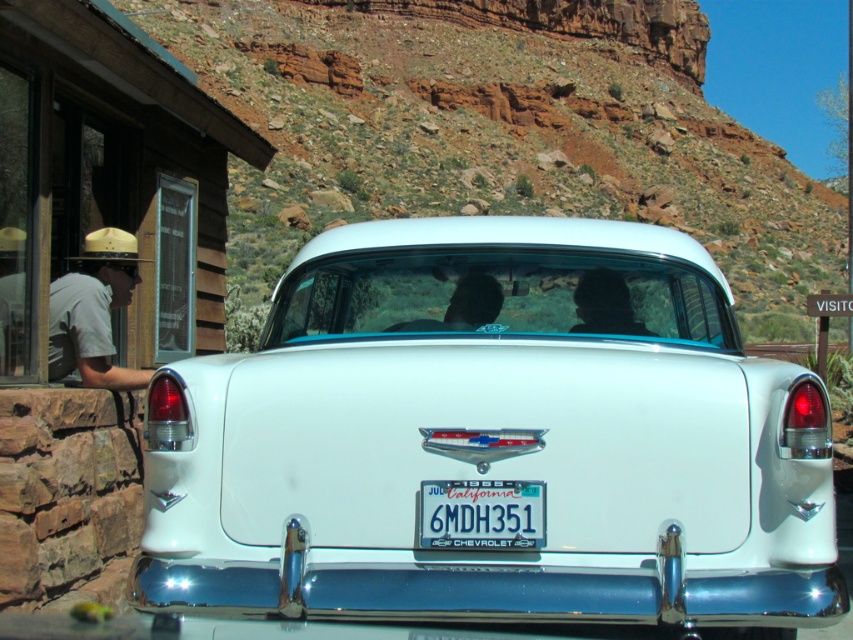
How much distance is there between chrome/metallic bumper at center and matte khaki hat at left?

chrome/metallic bumper at center is 3.33 meters from matte khaki hat at left.

Does point (415, 604) come behind point (138, 276)?

No, (415, 604) is in front of (138, 276).

Looking at this image, measure the distance between chrome/metallic bumper at center and camera.

A distance of 2.86 meters exists between chrome/metallic bumper at center and camera.

What are the coordinates of `chrome/metallic bumper at center` in the screenshot? It's located at (494, 593).

Which is above, matte khaki hat at left or white plastic license plate at center?

matte khaki hat at left

Is point (51, 368) behind point (479, 545)?

Yes.

The height and width of the screenshot is (640, 853). Describe the element at coordinates (94, 310) in the screenshot. I see `matte khaki hat at left` at that location.

Identify the location of matte khaki hat at left. The image size is (853, 640). (94, 310).

Who is positioned more to the left, white glossy car at center or chrome/metallic bumper at center?

white glossy car at center

Between white glossy car at center and chrome/metallic bumper at center, which one appears on the right side from the viewer's perspective?

chrome/metallic bumper at center is more to the right.

Is point (502, 326) closer to viewer compared to point (296, 618)?

No.

You are a GUI agent. You are given a task and a screenshot of the screen. Output one action in this format:
    pyautogui.click(x=<x>, y=<y>)
    Task: Click on the white glossy car at center
    
    Given the screenshot: What is the action you would take?
    pyautogui.click(x=494, y=438)